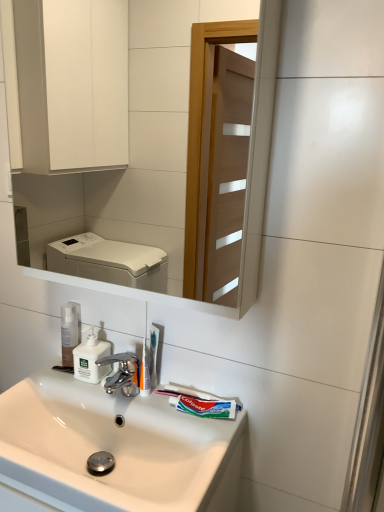
Question: Relative to white glossy sink at lower center, is transparent plastic pump bottle at center in front or behind?

Choices:
 (A) behind
 (B) front

Answer: (A)

Question: Is transparent plastic pump bottle at center wider or thinner than white glossy sink at lower center?

Choices:
 (A) thin
 (B) wide

Answer: (A)

Question: Which object is the farthest from the green matte toothpaste at lower center?

Choices:
 (A) white plastic toothbrush at center, which is the 1th toothbrush from front to back
 (B) white glossy sink at lower center
 (C) white plastic soap dispenser at center
 (D) white plastic toothbrush at center, acting as the second toothbrush starting from the front
 (E) white glossy mirror at upper center

Answer: (E)

Question: Which object is the closest to the green matte toothpaste at lower center?

Choices:
 (A) transparent plastic pump bottle at center
 (B) white plastic soap dispenser at center
 (C) white glossy mirror at upper center
 (D) white plastic toothbrush at center, acting as the second toothbrush starting from the front
 (E) white glossy sink at lower center

Answer: (D)